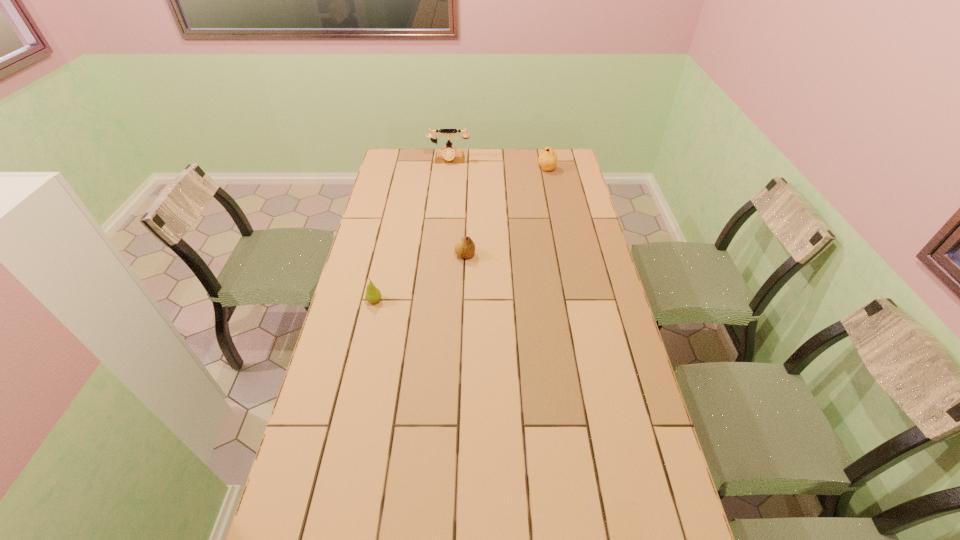
What are the coordinates of `free area in between the second pear from left to right and the leftmost object` in the screenshot? It's located at (420, 278).

You are a GUI agent. You are given a task and a screenshot of the screen. Output one action in this format:
    pyautogui.click(x=<x>, y=<y>)
    Task: Click on the vacant space that's between the tallest object and the leftmost object
    
    Given the screenshot: What is the action you would take?
    pyautogui.click(x=412, y=231)

Where is `free space between the farthest pear and the nearest object`? free space between the farthest pear and the nearest object is located at coordinates (461, 235).

This screenshot has height=540, width=960. In order to click on free spot between the telephone and the rightmost object in this screenshot , I will do `click(498, 165)`.

The image size is (960, 540). In order to click on empty space between the farthest pear and the tallest object in this screenshot , I will do click(x=498, y=165).

This screenshot has width=960, height=540. What are the coordinates of `free space that is in between the second pear from right to left and the telephone` in the screenshot? It's located at (457, 207).

You are a GUI agent. You are given a task and a screenshot of the screen. Output one action in this format:
    pyautogui.click(x=<x>, y=<y>)
    Task: Click on the free space between the nearest object and the second nearest object
    This screenshot has width=960, height=540.
    Given the screenshot: What is the action you would take?
    pyautogui.click(x=420, y=278)

The image size is (960, 540). I want to click on object that is the closest one to the nearest pear, so click(464, 247).

Choose which object is the third nearest neighbor to the third farthest object. Please provide its 2D coordinates. Your answer should be formatted as a tuple, i.e. [(x, y)], where the tuple contains the x and y coordinates of a point satisfying the conditions above.

[(448, 155)]

Locate which pear is the closest to the leftmost pear. Please provide its 2D coordinates. Your answer should be formatted as a tuple, i.e. [(x, y)], where the tuple contains the x and y coordinates of a point satisfying the conditions above.

[(464, 247)]